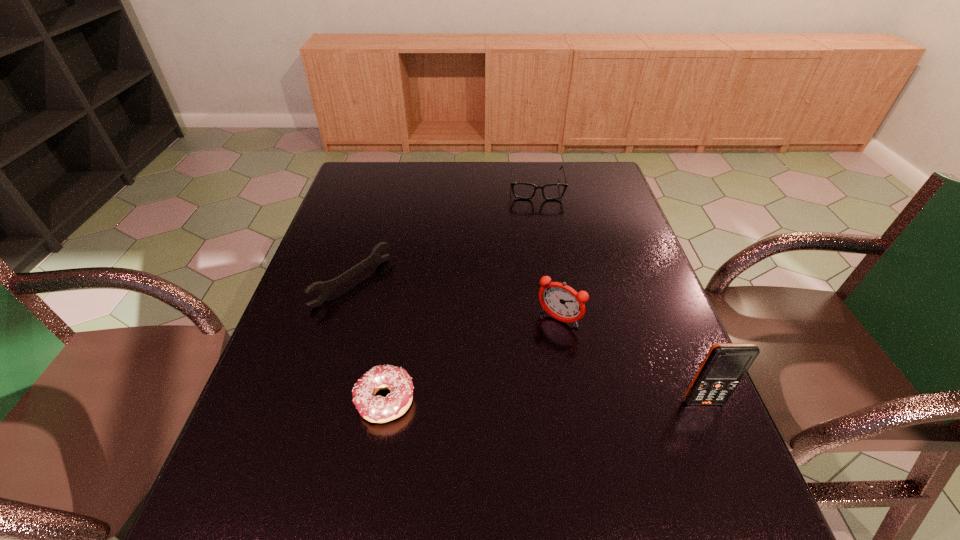
Where is `vacant space located 0.060m on the front-facing side of the alarm clock`? This screenshot has height=540, width=960. vacant space located 0.060m on the front-facing side of the alarm clock is located at coordinates (537, 347).

What are the coordinates of `free location located on the front-facing side of the spectacles` in the screenshot? It's located at (540, 248).

Locate an element on the screen. The height and width of the screenshot is (540, 960). vacant space located on the front-facing side of the spectacles is located at coordinates (540, 231).

Locate an element on the screen. free location located 0.260m on the front-facing side of the spectacles is located at coordinates tap(541, 253).

You are a GUI agent. You are given a task and a screenshot of the screen. Output one action in this format:
    pyautogui.click(x=<x>, y=<y>)
    Task: Click on the vacant space situated 0.360m on the open ends of the wrench
    The height and width of the screenshot is (540, 960).
    Given the screenshot: What is the action you would take?
    pyautogui.click(x=487, y=380)

Identify the location of blank space located on the open ends of the wrench. The image size is (960, 540). (426, 337).

Identify the location of vacant area located 0.090m on the open ends of the wrench. The height and width of the screenshot is (540, 960). (399, 318).

Locate an element on the screen. The image size is (960, 540). object that is at the far edge is located at coordinates coord(552,191).

Identify the location of object that is at the left edge. The width and height of the screenshot is (960, 540). (326, 288).

Find the location of `object located in the right edge section of the desktop`. object located in the right edge section of the desktop is located at coordinates (725, 364).